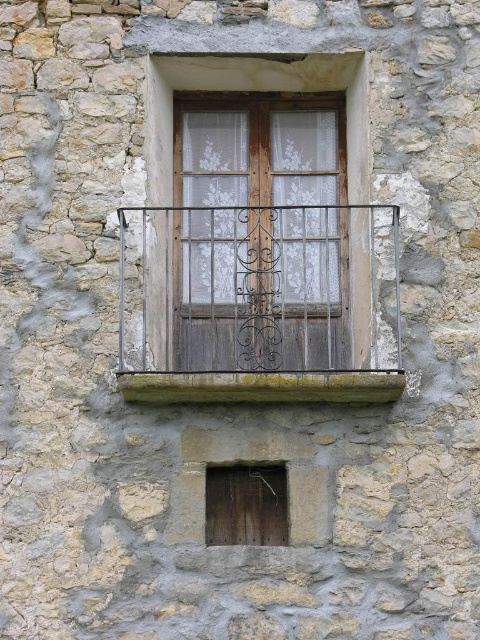
Question: Estimate the real-world distances between objects in this image. Which object is closer to the wooden frame at center?

Choices:
 (A) dark brown wrought iron balcony at center
 (B) green mossy wood at lower center

Answer: (A)

Question: Which object appears closest to the camera in this image?

Choices:
 (A) green mossy wood at lower center
 (B) dark brown wrought iron balcony at center
 (C) wooden door at lower center

Answer: (A)

Question: Which of the following is the farthest from the observer?

Choices:
 (A) wooden frame at center
 (B) dark brown wrought iron balcony at center
 (C) wooden door at lower center
 (D) green mossy wood at lower center

Answer: (B)

Question: Does dark brown wrought iron balcony at center have a larger size compared to green mossy wood at lower center?

Choices:
 (A) no
 (B) yes

Answer: (B)

Question: Is wooden frame at center to the right of green mossy wood at lower center from the viewer's perspective?

Choices:
 (A) no
 (B) yes

Answer: (A)

Question: Is dark brown wrought iron balcony at center smaller than green mossy wood at lower center?

Choices:
 (A) yes
 (B) no

Answer: (B)